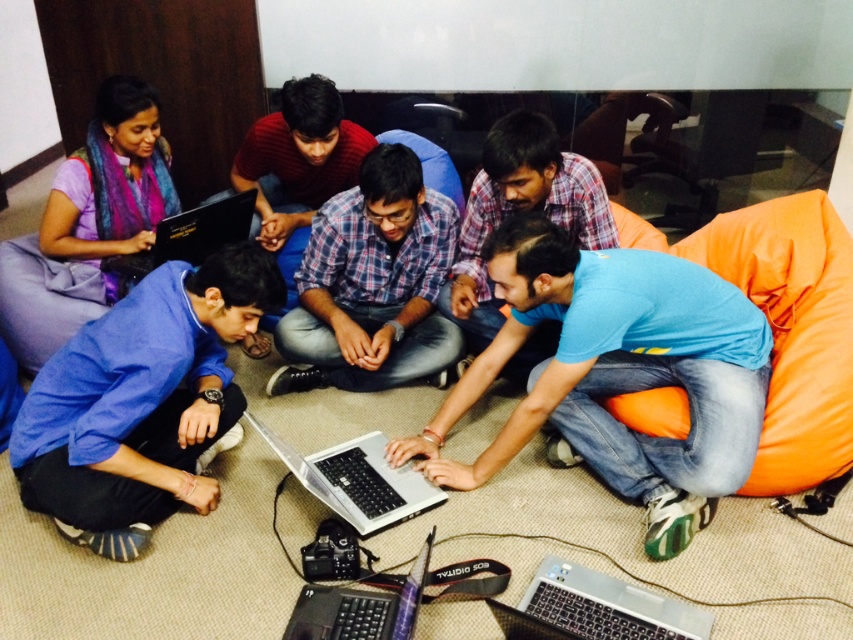
Consider the image. Between blue matte shirt at center and blue plaid shirt at center, which one has less height?

Standing shorter between the two is blue plaid shirt at center.

Is blue matte shirt at center to the left of blue plaid shirt at center from the viewer's perspective?

In fact, blue matte shirt at center is to the right of blue plaid shirt at center.

Is point (682, 336) positioned behind point (415, 348)?

No, (682, 336) is in front of (415, 348).

This screenshot has height=640, width=853. Find the location of `blue matte shirt at center`. blue matte shirt at center is located at coordinates pos(618,372).

Is point (566, 604) positioned after point (345, 493)?

No, it is in front of (345, 493).

Is the position of silver metallic laptop at lower center more distant than that of silver metallic laptop at center?

No, it is in front of silver metallic laptop at center.

Identify the location of silver metallic laptop at lower center. The width and height of the screenshot is (853, 640). (595, 609).

Is blue matte shirt at center shorter than black matte laptop at lower center?

Incorrect, blue matte shirt at center's height does not fall short of black matte laptop at lower center's.

Does blue matte shirt at center lie behind black matte laptop at lower center?

That is True.

What do you see at coordinates (618, 372) in the screenshot? I see `blue matte shirt at center` at bounding box center [618, 372].

Locate an element on the screen. Image resolution: width=853 pixels, height=640 pixels. blue matte shirt at center is located at coordinates (618, 372).